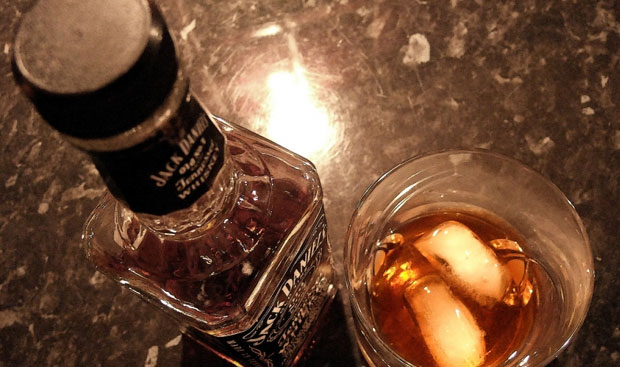
Identify the location of glass. This screenshot has height=367, width=620. (506, 174).